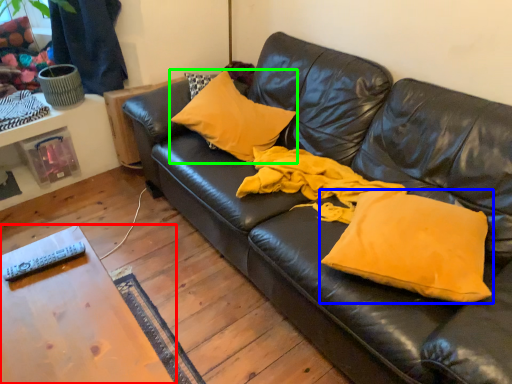
Question: Based on their relative distances, which object is nearer to table (highlighted by a red box)? Choose from pillow (highlighted by a blue box) and pillow (highlighted by a green box).

Choices:
 (A) pillow
 (B) pillow

Answer: (A)